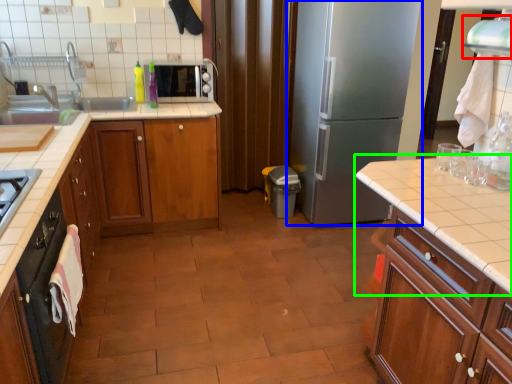
Question: Estimate the real-world distances between objects in this image. Which object is closer to exhaust hood (highlighted by a red box), refrigerator (highlighted by a blue box) or countertop (highlighted by a green box)?

Choices:
 (A) refrigerator
 (B) countertop

Answer: (B)